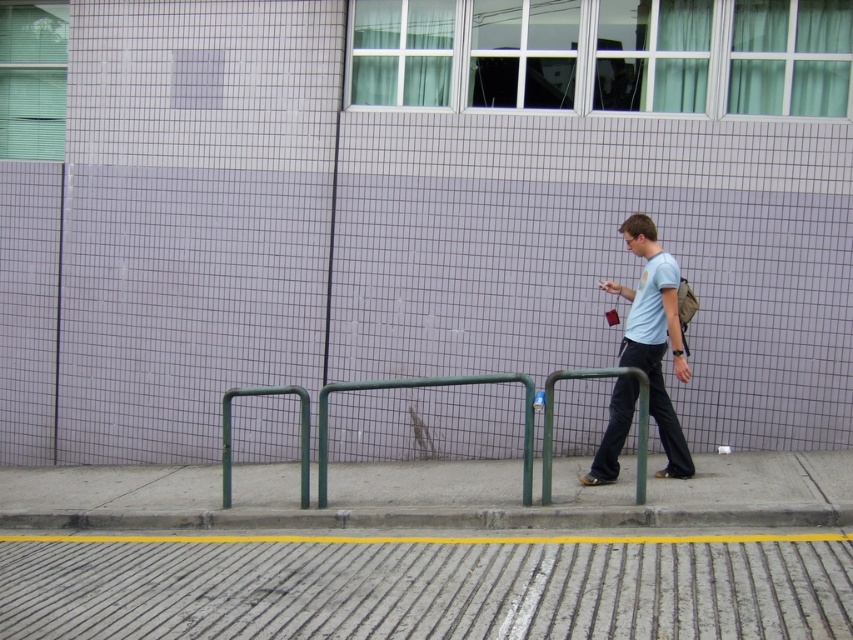
You are a visually impaired person using a cane to navigate the sidewalk. You encounter the yellow tactile paving strip and need to locate the green metal rail at center. Based on the scene, which direction should you move relative to the concrete textured pavement at lower center to find the rail?

The concrete textured pavement at lower center is positioned on the left side of the green metal rail at center. To locate the rail, you should move to the right from the concrete textured pavement at lower center.